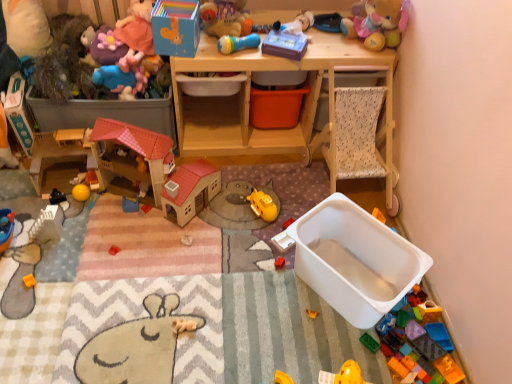
I want to click on free space between yellow matte submarine at center, marked as the 9th toy in a left-to-right arrangement, and yellow rubber ball at center-left, which is the 11th toy from right to left, so click(x=195, y=209).